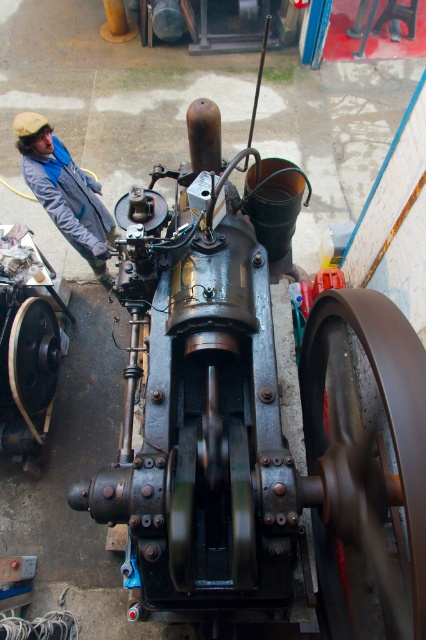
Between brown rubber wheel at center right and matte black wheel at left, which one is positioned higher?

Positioned higher is matte black wheel at left.

Does brown rubber wheel at center right have a lesser height compared to matte black wheel at left?

In fact, brown rubber wheel at center right may be taller than matte black wheel at left.

The height and width of the screenshot is (640, 426). What are the coordinates of `brown rubber wheel at center right` in the screenshot? It's located at (365, 464).

Does gray fabric jacket at left have a larger size compared to matte black wheel at left?

Yes.

Looking at this image, is gray fabric jacket at left further to camera compared to matte black wheel at left?

That is True.

This screenshot has width=426, height=640. What are the coordinates of `gray fabric jacket at left` in the screenshot? It's located at (65, 192).

Which is below, brown rubber wheel at center right or gray fabric jacket at left?

Positioned lower is brown rubber wheel at center right.

Can you confirm if brown rubber wheel at center right is thinner than gray fabric jacket at left?

No, brown rubber wheel at center right is not thinner than gray fabric jacket at left.

What do you see at coordinates (365, 464) in the screenshot? I see `brown rubber wheel at center right` at bounding box center [365, 464].

Identify the location of brown rubber wheel at center right. (365, 464).